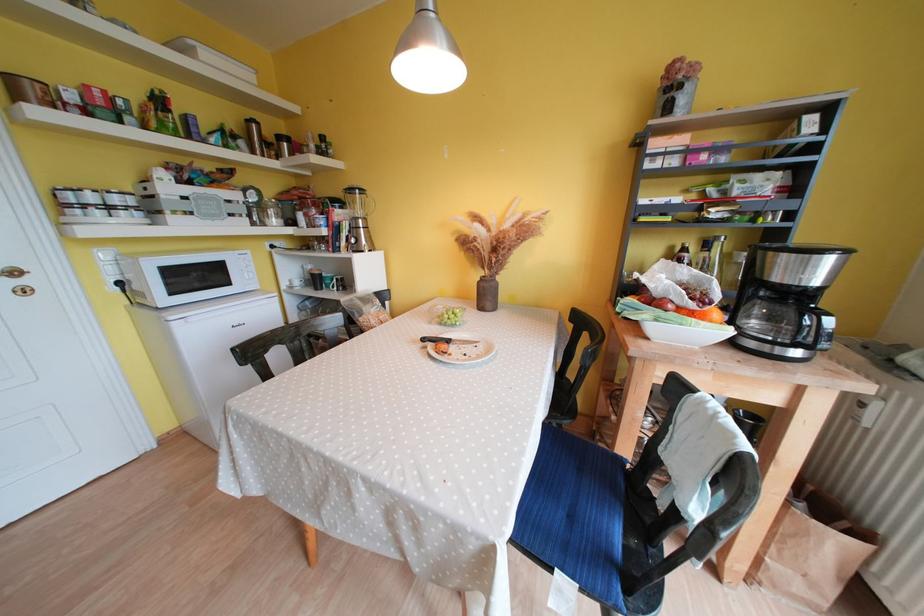
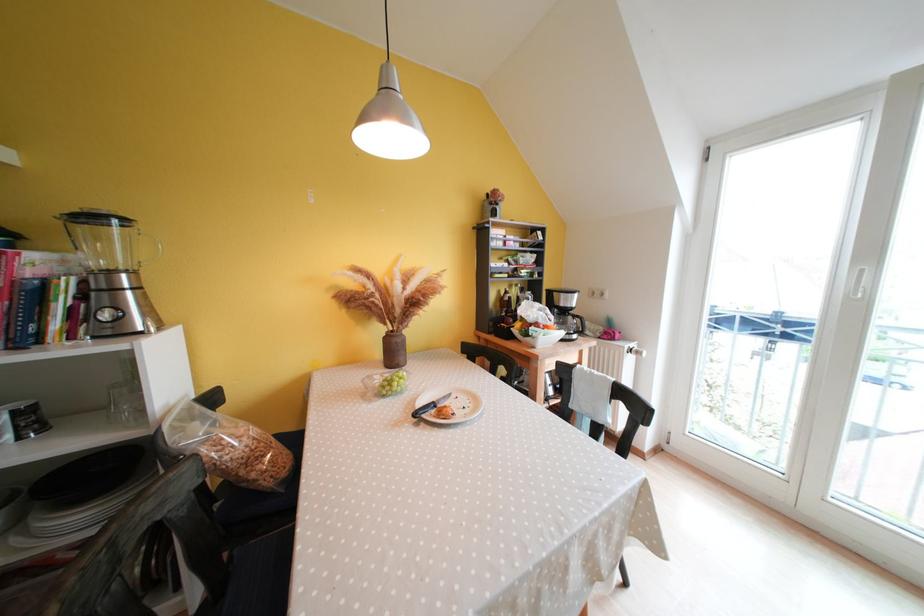
Question: The camera is either moving clockwise (left) or counter-clockwise (right) around the object. The first image is from the beginning of the video and the second image is from the end. Is the camera moving left or right when shooting the video?

Choices:
 (A) Left
 (B) Right

Answer: (A)